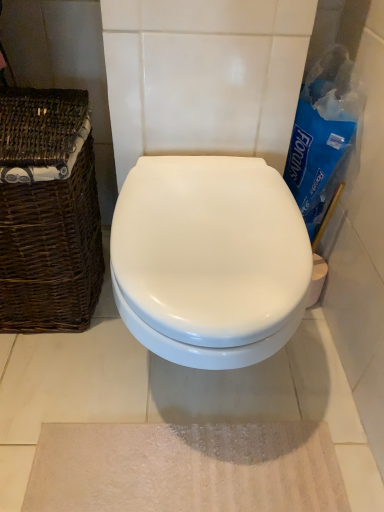
Question: Is beige textured bath mat at lower center inside the boundaries of white glossy toilet at center, or outside?

Choices:
 (A) outside
 (B) inside

Answer: (A)

Question: From the image's perspective, is beige textured bath mat at lower center positioned above or below white glossy toilet at center?

Choices:
 (A) above
 (B) below

Answer: (B)

Question: Estimate the real-world distances between objects in this image. Which object is farther from the brown woven basket at left?

Choices:
 (A) beige textured bath mat at lower center
 (B) white glossy toilet at center

Answer: (A)

Question: Which is nearer to the brown woven basket at left?

Choices:
 (A) white glossy toilet at center
 (B) beige textured bath mat at lower center

Answer: (A)